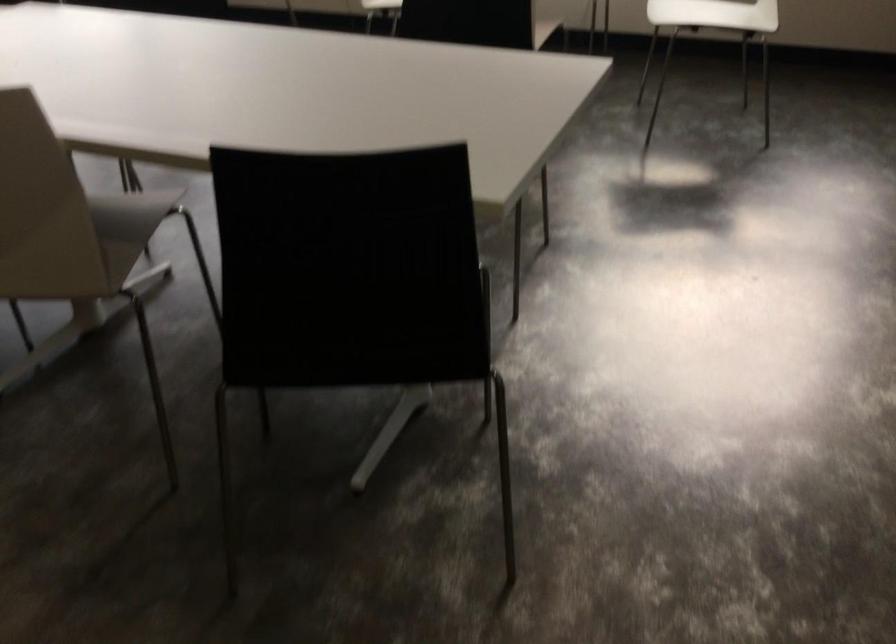
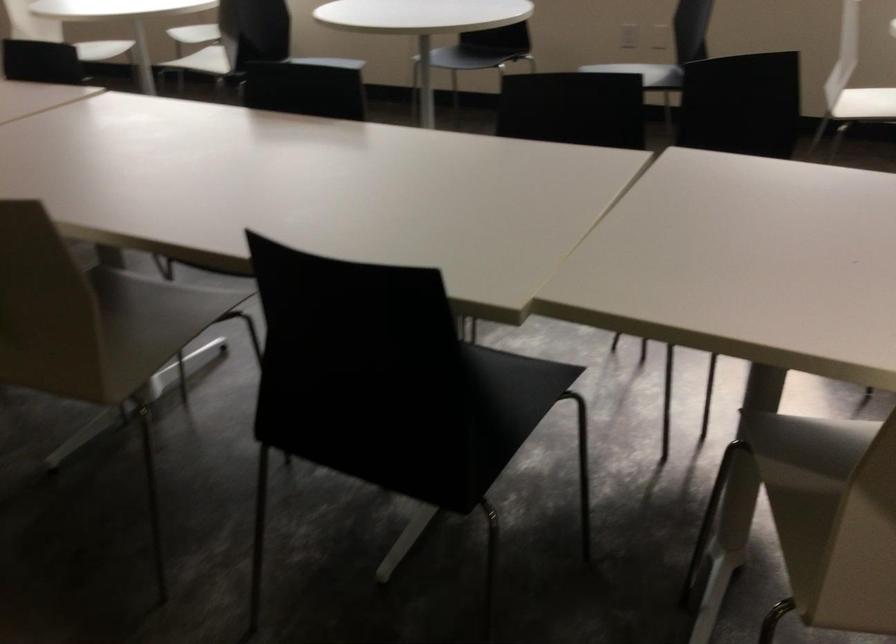
Question: Which direction would the cameraman need to move to produce the second image? Reply with the corresponding letter.

Choices:
 (A) Left
 (B) Right
 (C) Forward
 (D) Backward

Answer: (A)